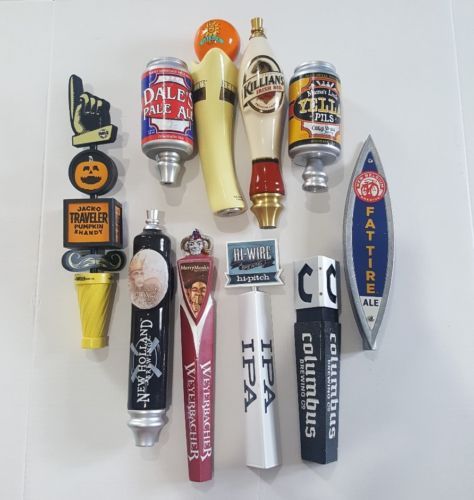
In order to click on taps in this screenshot , I will do `click(309, 400)`, `click(255, 400)`, `click(197, 390)`, `click(143, 360)`, `click(95, 303)`, `click(365, 247)`, `click(303, 132)`, `click(252, 134)`, `click(210, 129)`, `click(165, 121)`.